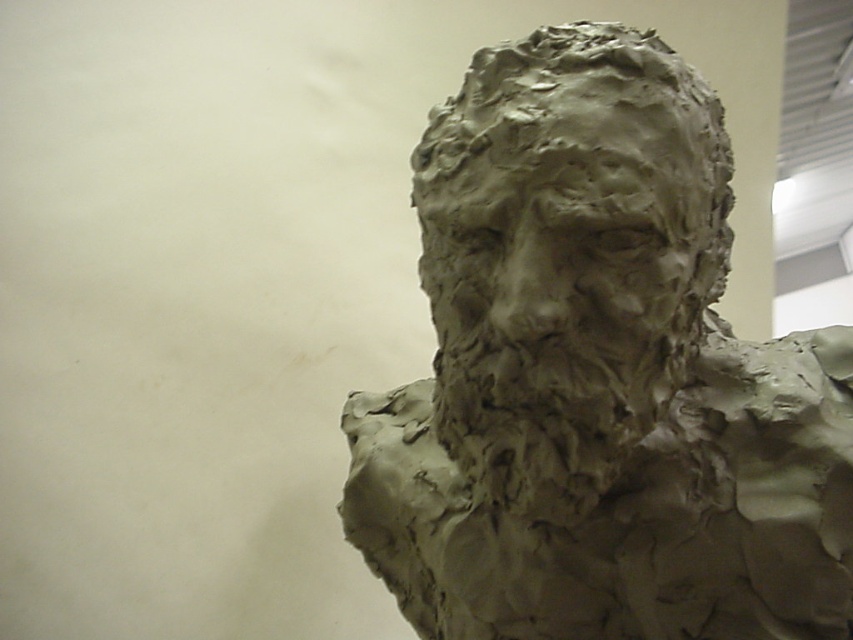
You are an art student analyzing the image of a sculpted bust. You notice two objects labeled gray clay bust at center and clay sculpture at center. According to the description, which one is positioned lower in the image?

The gray clay bust at center is positioned lower than the clay sculpture at center.

You are an art student examining the sculpture. You notice two objects labeled as the gray clay bust at center and the clay sculpture at center. Which one is taller?

The gray clay bust at center is taller than the clay sculpture at center.

In the scene shown: You are an art student analyzing the image of two sculptures. You see the gray clay bust at center and the clay sculpture at center. Which one is located to the right?

The gray clay bust at center is positioned on the right side of the clay sculpture at center, so the gray clay bust at center is to the right.